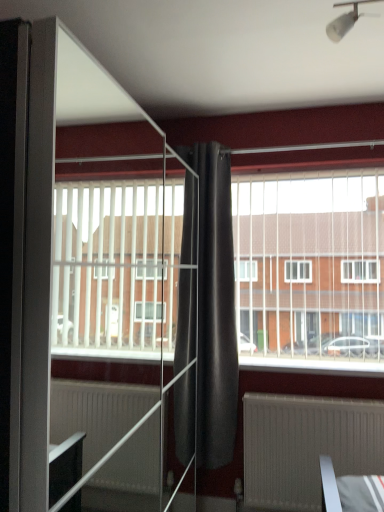
Question: Does matte gray radiator at lower center have a lesser height compared to transparent glass screen door at center?

Choices:
 (A) yes
 (B) no

Answer: (A)

Question: Considering the relative sizes of matte gray radiator at lower center and transparent glass screen door at center in the image provided, is matte gray radiator at lower center bigger than transparent glass screen door at center?

Choices:
 (A) no
 (B) yes

Answer: (A)

Question: Are matte gray radiator at lower center and transparent glass screen door at center making contact?

Choices:
 (A) no
 (B) yes

Answer: (A)

Question: Does matte gray radiator at lower center appear on the left side of transparent glass screen door at center?

Choices:
 (A) no
 (B) yes

Answer: (A)

Question: From the image's perspective, is matte gray radiator at lower center beneath transparent glass screen door at center?

Choices:
 (A) yes
 (B) no

Answer: (A)

Question: From the image's perspective, is transparent glass screen door at center above or below white plastic light fixture at upper center?

Choices:
 (A) below
 (B) above

Answer: (A)

Question: From their relative heights in the image, would you say transparent glass screen door at center is taller or shorter than white plastic light fixture at upper center?

Choices:
 (A) short
 (B) tall

Answer: (B)

Question: Relative to white plastic light fixture at upper center, is transparent glass screen door at center in front or behind?

Choices:
 (A) behind
 (B) front

Answer: (B)

Question: Would you say transparent glass screen door at center is inside or outside white plastic light fixture at upper center?

Choices:
 (A) inside
 (B) outside

Answer: (B)

Question: Is point (279, 477) closer or farther from the camera than point (365, 185)?

Choices:
 (A) farther
 (B) closer

Answer: (B)

Question: In the image, is matte gray radiator at lower center positioned in front of or behind white plastic blinds at center?

Choices:
 (A) front
 (B) behind

Answer: (A)

Question: From a real-world perspective, is matte gray radiator at lower center positioned above or below white plastic blinds at center?

Choices:
 (A) above
 (B) below

Answer: (B)

Question: In terms of size, does matte gray radiator at lower center appear bigger or smaller than white plastic blinds at center?

Choices:
 (A) small
 (B) big

Answer: (A)

Question: From a real-world perspective, relative to dark matte curtain at center, is white plastic light fixture at upper center vertically above or below?

Choices:
 (A) above
 (B) below

Answer: (A)

Question: In terms of width, does white plastic light fixture at upper center look wider or thinner when compared to dark matte curtain at center?

Choices:
 (A) thin
 (B) wide

Answer: (A)